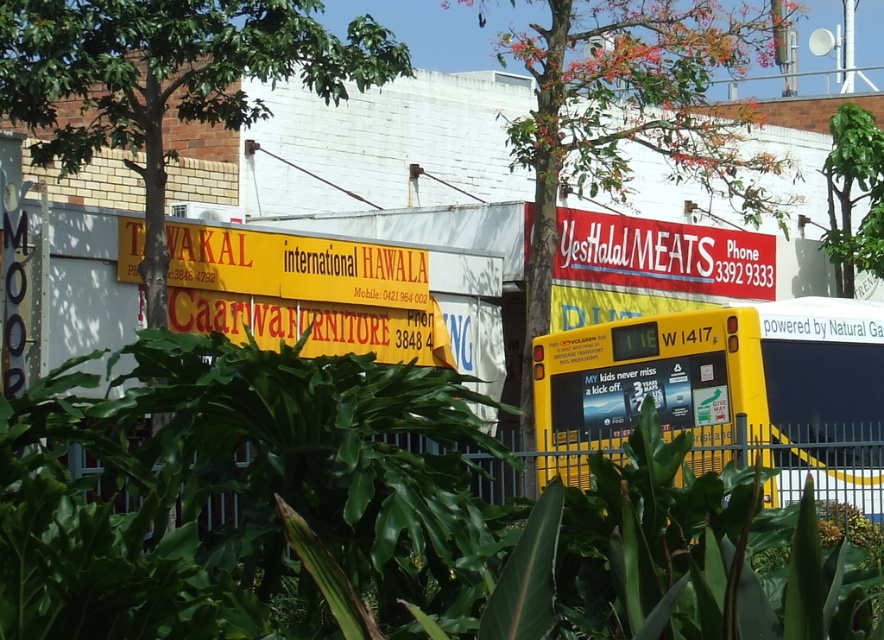
Looking at this image, you are a pedestrian standing on the sidewalk and want to cross the street to reach the yellow sign for TAWAKAL International Hawala. There is a green leafy tree at upper left and a yellow matte bus at center in your view. Which object would block your view of the yellow sign if you look towards the bus?

The green leafy tree at upper left is behind the yellow matte bus at center, so the bus would block your view of the tree but not the yellow sign. However, the yellow sign is on the left side of the street, so the bus might block part of it depending on its position. Wait, the question says the pedestrian wants to cross to reach the yellow sign for TAWAKAL, which is on the left side. The bus is at center, so if the pedestrian is on the sidewalk and looking towards the bus, the bus might block the view of T.

You are a delivery driver who needs to park your vehicle under the green leafy tree at upper left to avoid the sun. Your vehicle is the yellow matte bus at center. Can your bus fit under the tree without hitting its branches?

The yellow matte bus at center has a lesser height compared to green leafy tree at upper left, so yes, the bus can fit under the tree without hitting its branches since it is shorter than the tree.

You are a customer looking for the nearest halal meat store. You see the green leafy plants at center and the green leafy tree at upper right. Which object is taller?

The green leafy tree at upper right is taller than the green leafy plants at center.